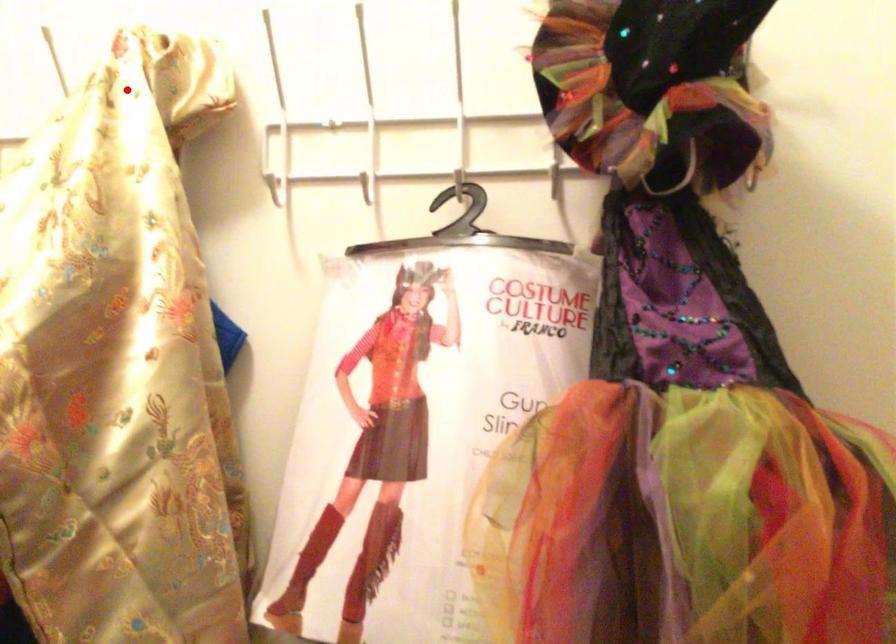
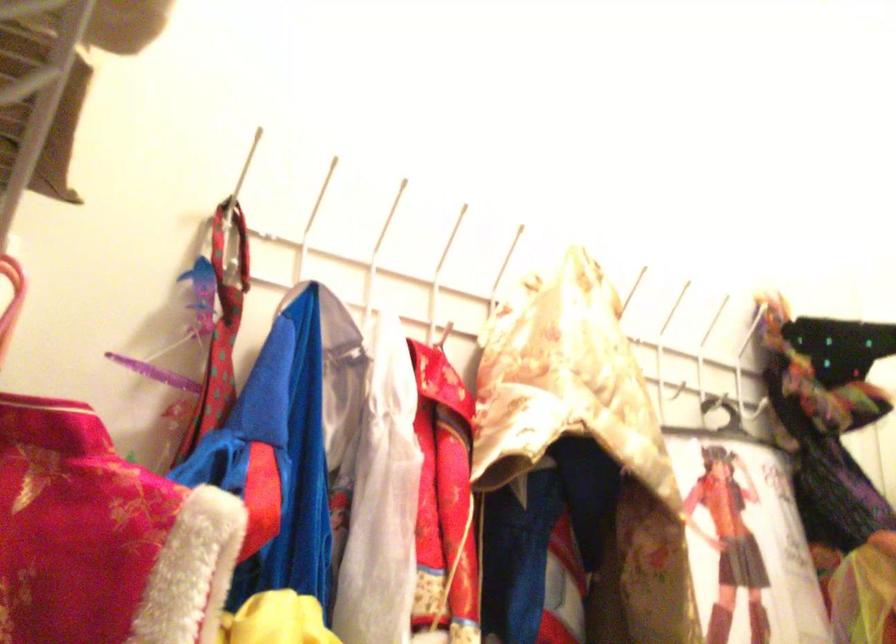
Locate, in the second image, the point that corresponds to the highlighted location in the first image.

(505, 261)